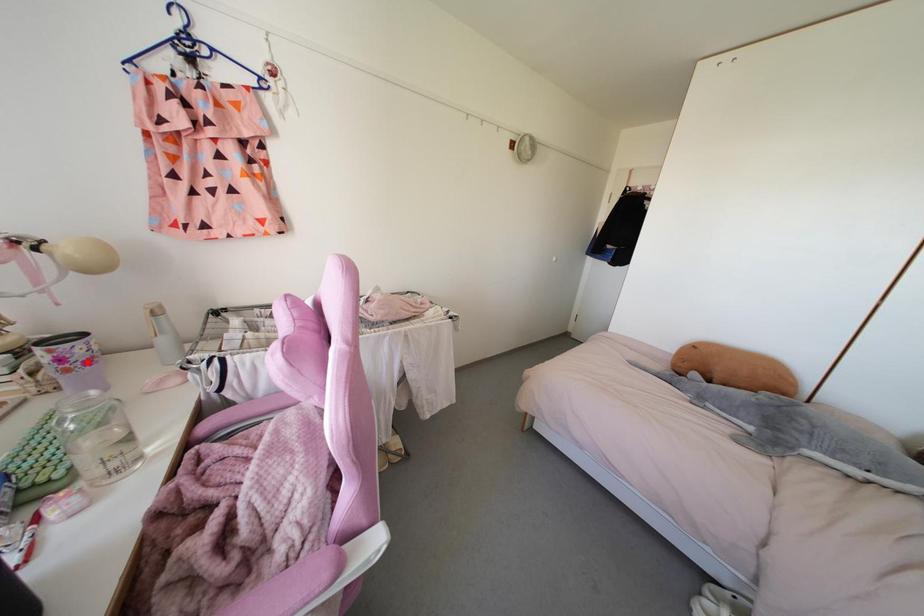
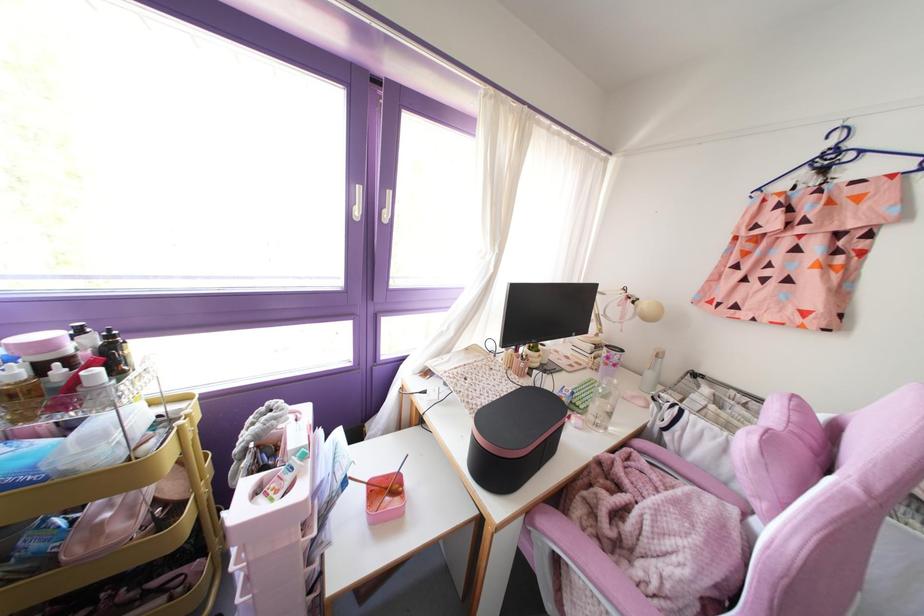
Locate, in the second image, the point that corresponds to the highlighted location in the first image.

(614, 365)